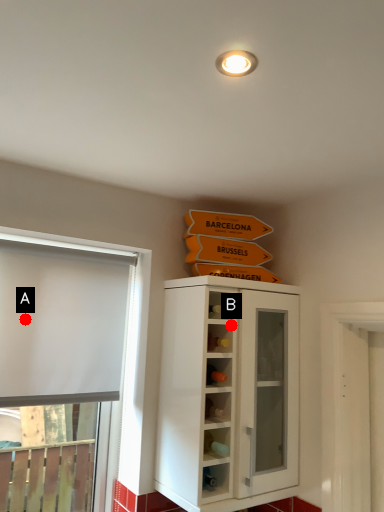
Question: Two points are circled on the image, labeled by A and B beside each circle. Which point is closer to the camera taking this photo?

Choices:
 (A) A is closer
 (B) B is closer

Answer: (A)